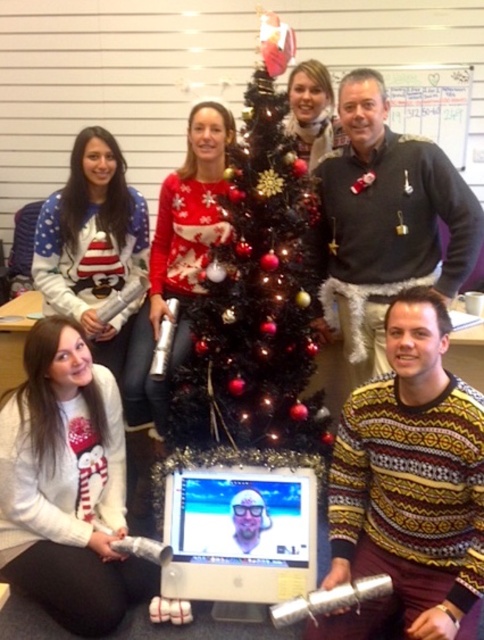
Question: Is shiny metallic christmas tree at center positioned behind matte white sweater at center?

Choices:
 (A) no
 (B) yes

Answer: (A)

Question: Which object appears farthest from the camera in this image?

Choices:
 (A) matte white sweater at center
 (B) white glossy monitor at center

Answer: (A)

Question: Estimate the real-world distances between objects in this image. Which object is farther from the white knit sweater at lower left?

Choices:
 (A) white fleece sweater at upper left
 (B) yellow and brown sweater at center

Answer: (B)

Question: Does white knit sweater at lower left lie behind dark gray sweater at upper center?

Choices:
 (A) yes
 (B) no

Answer: (B)

Question: Is dark gray sweater at upper center below white glossy monitor at center?

Choices:
 (A) no
 (B) yes

Answer: (A)

Question: Which point is closer to the camera?

Choices:
 (A) yellow and brown sweater at center
 (B) white glossy monitor at center
 (C) white fleece sweater at upper left
 (D) shiny metallic christmas tree at center

Answer: (A)